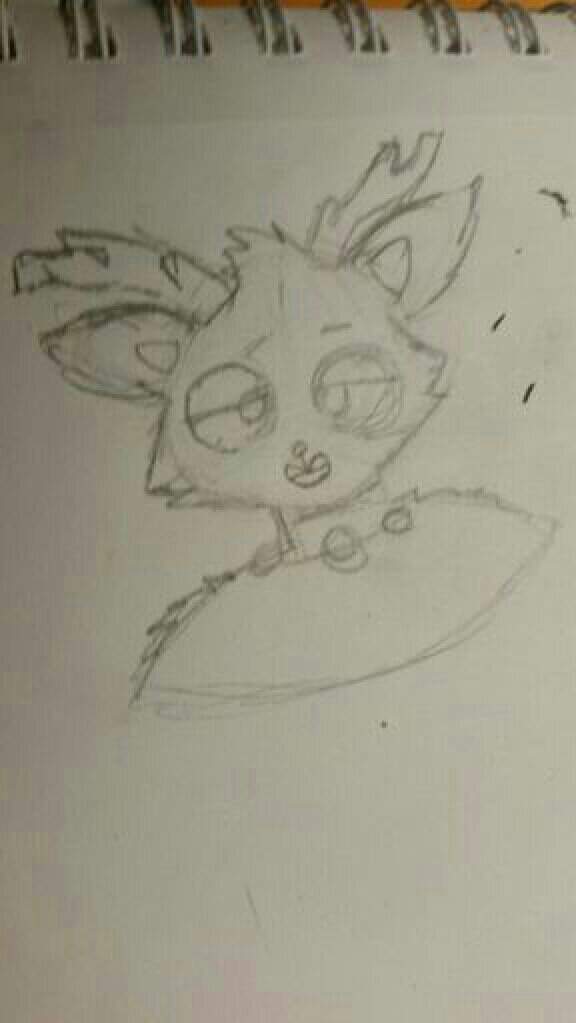
You are a GUI agent. You are given a task and a screenshot of the screen. Output one action in this format:
    pyautogui.click(x=<x>, y=<y>)
    Task: Click on the white sheet
    The image size is (576, 1023).
    Given the screenshot: What is the action you would take?
    point(264,806)